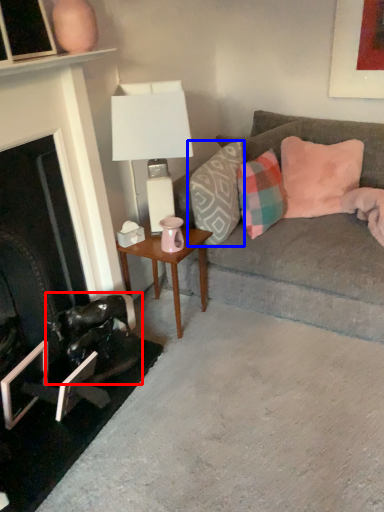
Question: Which of the following is the farthest to the observer, swivel chair (highlighted by a red box) or pillow (highlighted by a blue box)?

Choices:
 (A) swivel chair
 (B) pillow

Answer: (B)